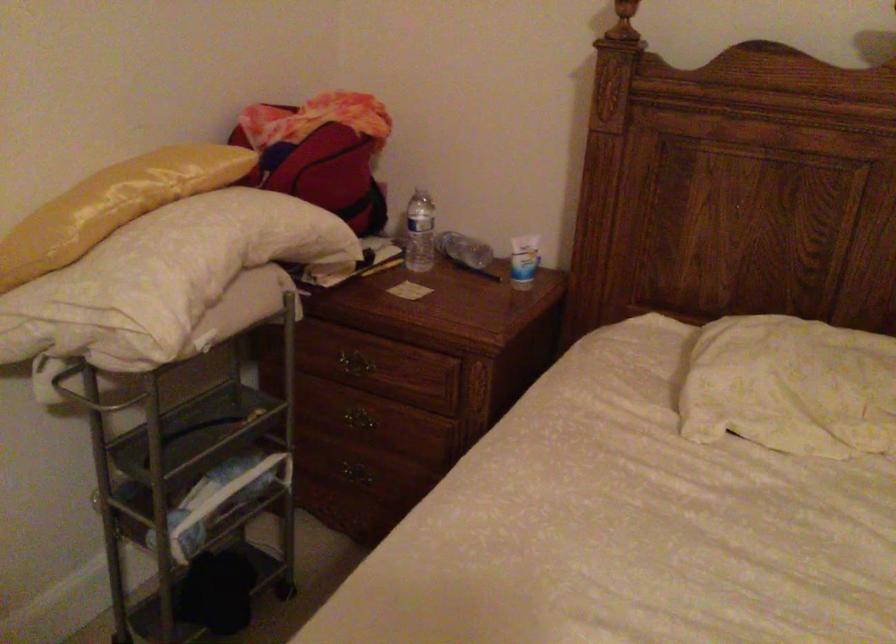
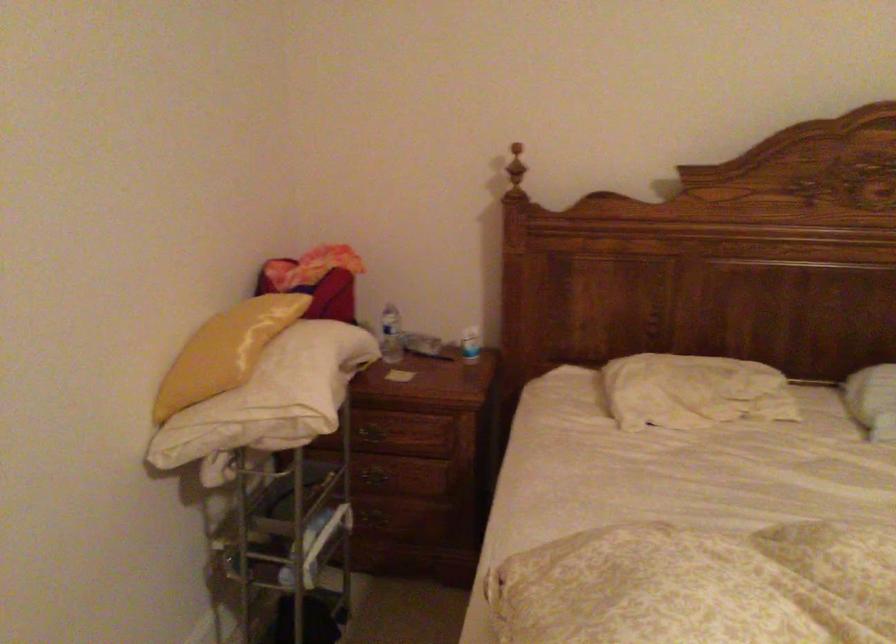
In the second image, find the point that corresponds to point 359,469 in the first image.

(381, 516)